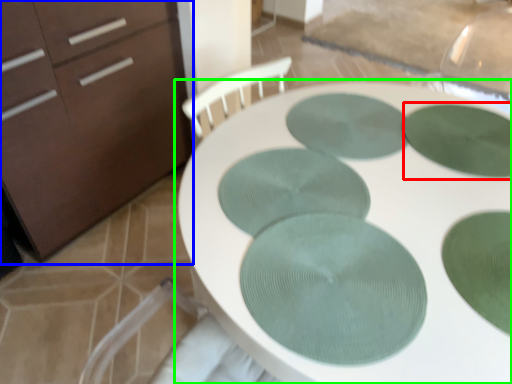
Question: Which object is the farthest from glass plate (highlighted by a red box)? Choose among these: chest of drawers (highlighted by a blue box) or table (highlighted by a green box).

Choices:
 (A) chest of drawers
 (B) table

Answer: (A)